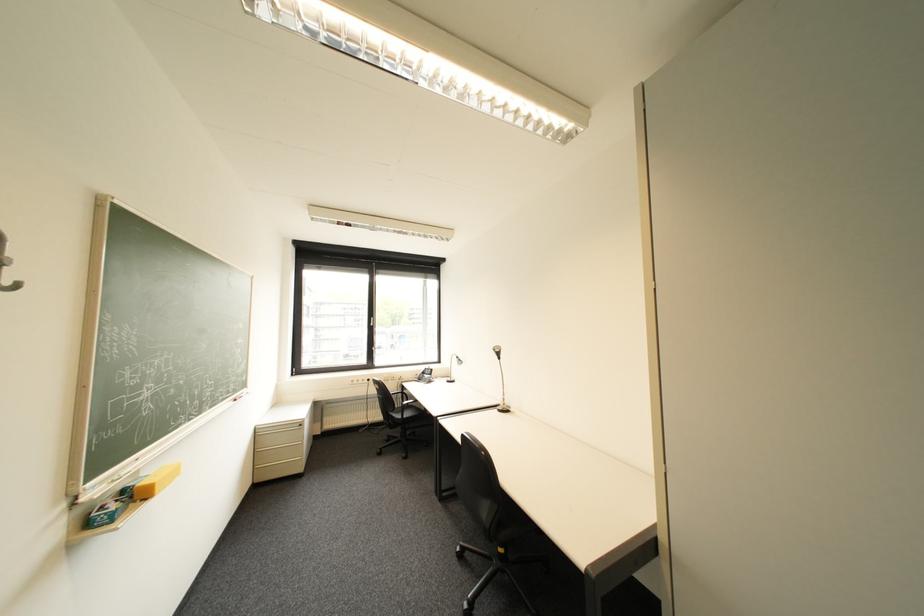
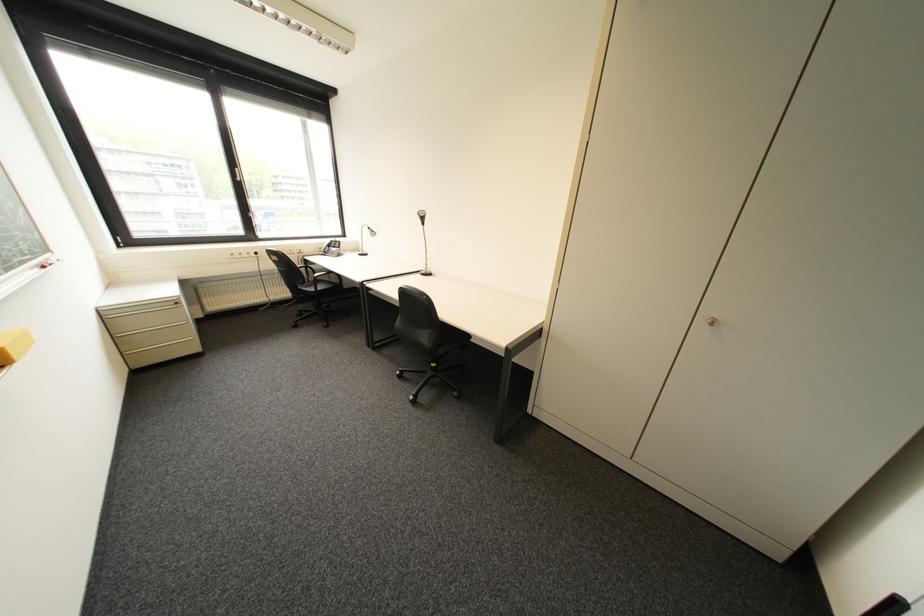
Locate, in the second image, the point that corresponds to [495,509] in the first image.

(435, 338)